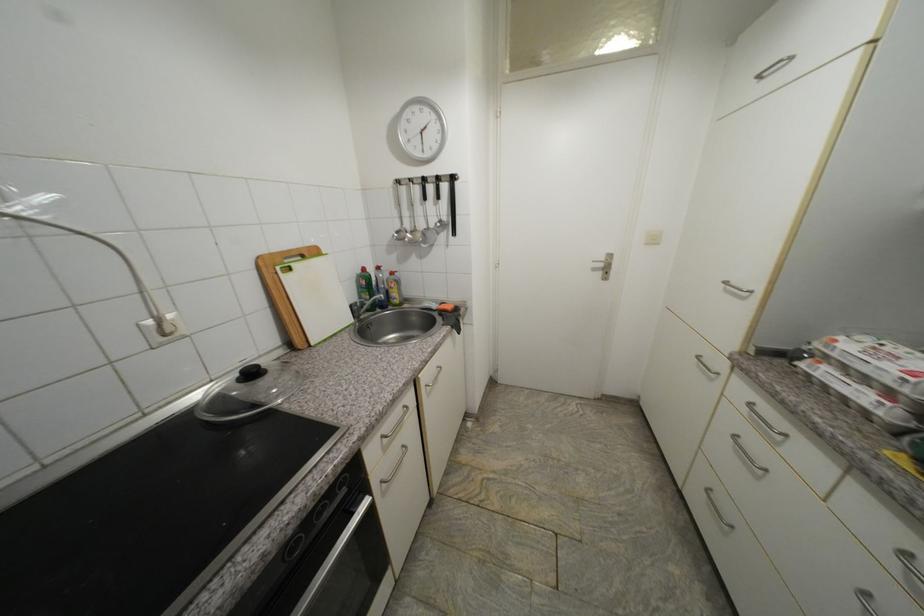
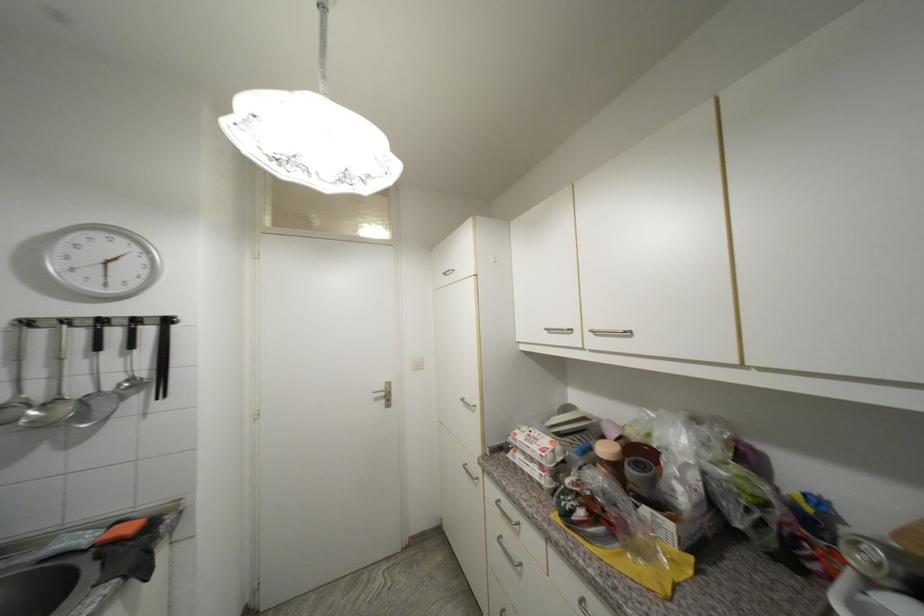
Locate, in the second image, the point that corresponds to point (455, 309) in the first image.

(137, 530)